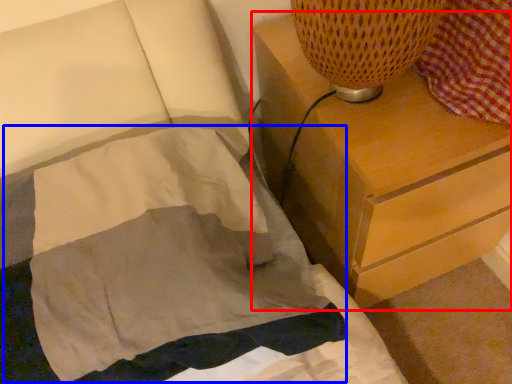
Question: Which object appears closest to the camera in this image, chest of drawers (highlighted by a red box) or blanket (highlighted by a blue box)?

Choices:
 (A) chest of drawers
 (B) blanket

Answer: (B)